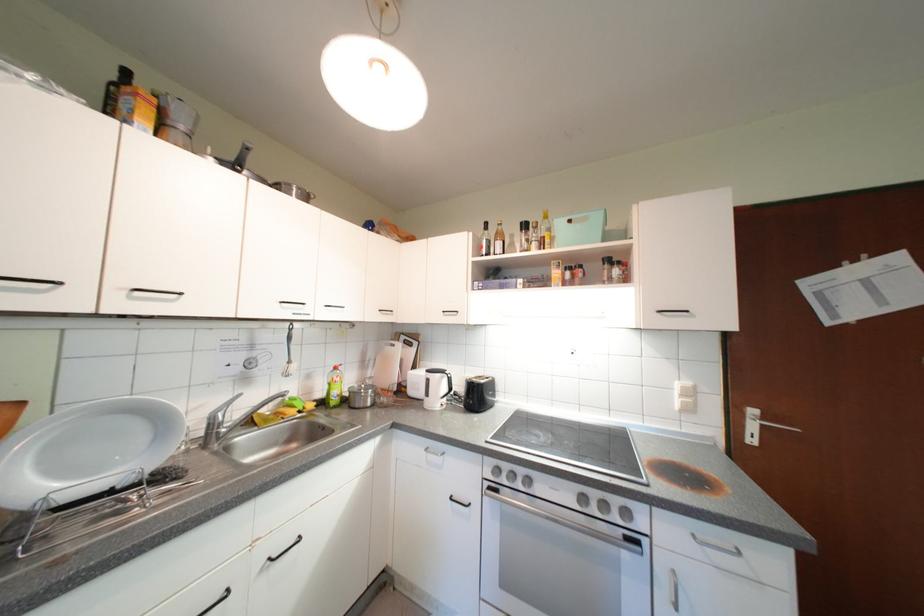
Find where to turn the faucet handle. Please return your answer as a coordinate pair (x, y).

(225, 408)